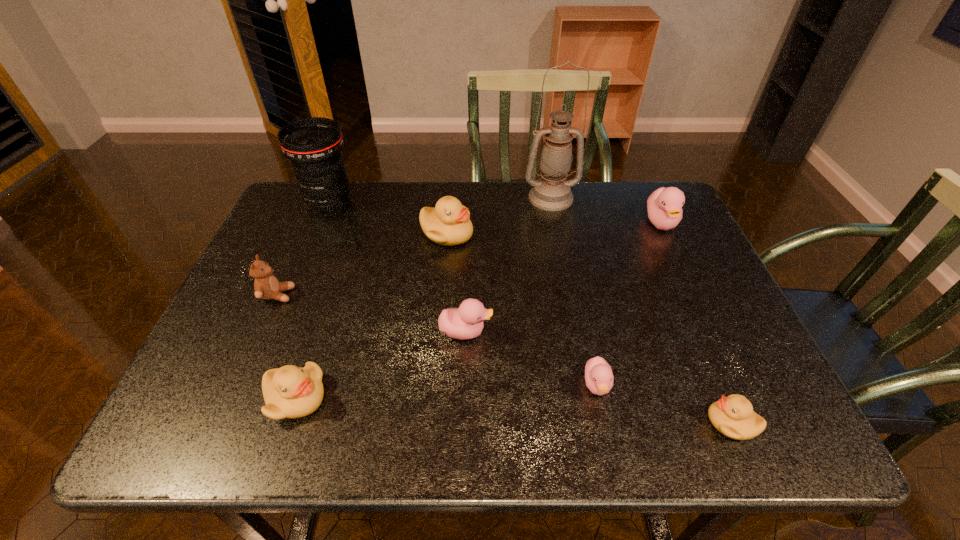
Identify which object is the seventh nearest to the leftmost yellow duckling. Please provide its 2D coordinates. Your answer should be formatted as a tuple, i.e. [(x, y)], where the tuple contains the x and y coordinates of a point satisfying the conditions above.

[(733, 416)]

Locate an element on the screen. the third closest duckling to the farthest yellow duckling is located at coordinates 599,378.

You are a GUI agent. You are given a task and a screenshot of the screen. Output one action in this format:
    pyautogui.click(x=<x>, y=<y>)
    Task: Click on the duckling that is the third nearest to the nearest pink duckling
    This screenshot has height=540, width=960.
    Given the screenshot: What is the action you would take?
    pyautogui.click(x=449, y=223)

Identify the location of pink duckling that stands as the closest to the rightmost pink duckling. This screenshot has height=540, width=960. (599, 378).

Locate an element on the screen. The width and height of the screenshot is (960, 540). pink duckling that is the closest to the farthest yellow duckling is located at coordinates (466, 322).

You are a GUI agent. You are given a task and a screenshot of the screen. Output one action in this format:
    pyautogui.click(x=<x>, y=<y>)
    Task: Click on the yellow duckling object that ranks as the second closest to the second smallest yellow duckling
    The height and width of the screenshot is (540, 960).
    Given the screenshot: What is the action you would take?
    pyautogui.click(x=733, y=416)

Find the location of a particular element. yellow duckling that is the third closest to the biggest pink duckling is located at coordinates (290, 392).

Locate an element on the screen. The width and height of the screenshot is (960, 540). free space that satisfies the following two spatial constraints: 1. on the front-facing side of the second pink duckling from left to right; 2. on the beak of the leftmost duckling is located at coordinates (600, 399).

This screenshot has height=540, width=960. I want to click on vacant space that satisfies the following two spatial constraints: 1. on the front-facing side of the farthest pink duckling; 2. on the beak of the rightmost yellow duckling, so click(x=755, y=422).

In order to click on free space that satisfies the following two spatial constraints: 1. on the front-facing side of the second pink duckling from right to left; 2. on the beak of the second biggest yellow duckling in this screenshot , I will do `click(600, 399)`.